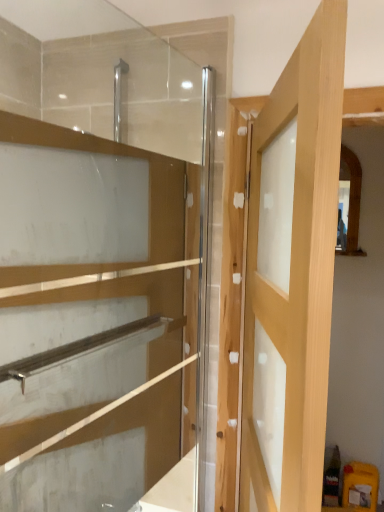
Question: Is light wood door at center spatially inside transparent glass cabinet at upper left, or outside of it?

Choices:
 (A) inside
 (B) outside

Answer: (B)

Question: From a real-world perspective, is light wood door at center positioned above or below transparent glass cabinet at upper left?

Choices:
 (A) above
 (B) below

Answer: (B)

Question: Considering the positions of light wood door at center and transparent glass cabinet at upper left in the image, is light wood door at center wider or thinner than transparent glass cabinet at upper left?

Choices:
 (A) wide
 (B) thin

Answer: (A)

Question: Visually, is transparent glass cabinet at upper left positioned to the left or to the right of light wood door at center?

Choices:
 (A) right
 (B) left

Answer: (B)

Question: From a real-world perspective, is transparent glass cabinet at upper left above or below light wood door at center?

Choices:
 (A) above
 (B) below

Answer: (A)

Question: Is transparent glass cabinet at upper left wider or thinner than light wood door at center?

Choices:
 (A) wide
 (B) thin

Answer: (B)

Question: Which is correct: transparent glass cabinet at upper left is inside light wood door at center, or outside of it?

Choices:
 (A) inside
 (B) outside

Answer: (B)